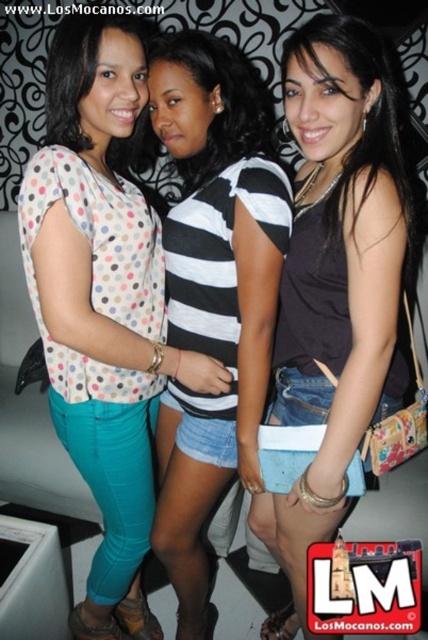
Can you confirm if polka dot fabric blouse at center is bigger than dark brown leather tank top at center?

Correct, polka dot fabric blouse at center is larger in size than dark brown leather tank top at center.

Which is more to the left, polka dot fabric blouse at center or dark brown leather tank top at center?

polka dot fabric blouse at center

Between point (104, 497) and point (395, 269), which one is positioned behind?

The point (104, 497) is more distant.

In order to click on polka dot fabric blouse at center in this screenshot , I will do `click(103, 300)`.

Is polka dot fabric blouse at center smaller than striped jersey at center?

No.

Who is lower down, polka dot fabric blouse at center or striped jersey at center?

striped jersey at center is below.

Where is `polka dot fabric blouse at center`? polka dot fabric blouse at center is located at coordinates (103, 300).

Is dark brown leather tank top at center closer to camera compared to striped jersey at center?

Yes, dark brown leather tank top at center is closer to the viewer.

Is dark brown leather tank top at center below striped jersey at center?

No, dark brown leather tank top at center is not below striped jersey at center.

Locate an element on the screen. The height and width of the screenshot is (640, 428). dark brown leather tank top at center is located at coordinates (336, 276).

Locate an element on the screen. This screenshot has width=428, height=640. dark brown leather tank top at center is located at coordinates (336, 276).